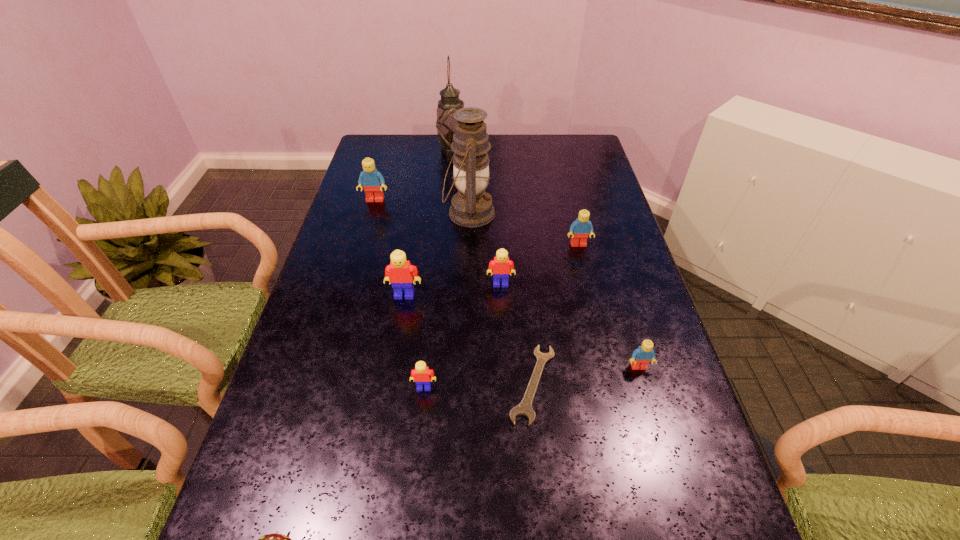
The height and width of the screenshot is (540, 960). What are the coordinates of `the third Lego from left to right` in the screenshot? It's located at (421, 375).

At what (x,y) coordinates should I click in order to perform the action: click on the nearest Lego. Please return your answer as a coordinate pair (x, y). This screenshot has width=960, height=540. Looking at the image, I should click on (421, 375).

Find the location of a particular element. This screenshot has height=540, width=960. the rightmost blue Lego is located at coordinates (642, 356).

Identify the location of the nearest blue Lego. The height and width of the screenshot is (540, 960). (642, 356).

Locate an element on the screen. The width and height of the screenshot is (960, 540). the shortest object is located at coordinates (524, 408).

Where is `free space located 0.230m on the front of the farther oil lamp`? The height and width of the screenshot is (540, 960). free space located 0.230m on the front of the farther oil lamp is located at coordinates (448, 193).

Locate an element on the screen. This screenshot has height=540, width=960. free space located 0.260m on the front of the nearer oil lamp is located at coordinates (467, 300).

You are a GUI agent. You are given a task and a screenshot of the screen. Output one action in this format:
    pyautogui.click(x=<x>, y=<y>)
    Task: Click on the vacant point located 0.340m on the face of the leftmost blue Lego
    
    Given the screenshot: What is the action you would take?
    pyautogui.click(x=352, y=278)

Locate an element on the screen. vacant space situated on the front-facing side of the leftmost yellow Lego is located at coordinates tap(399, 324).

The height and width of the screenshot is (540, 960). I want to click on blank area located on the face of the seventh nearest object, so click(x=600, y=334).